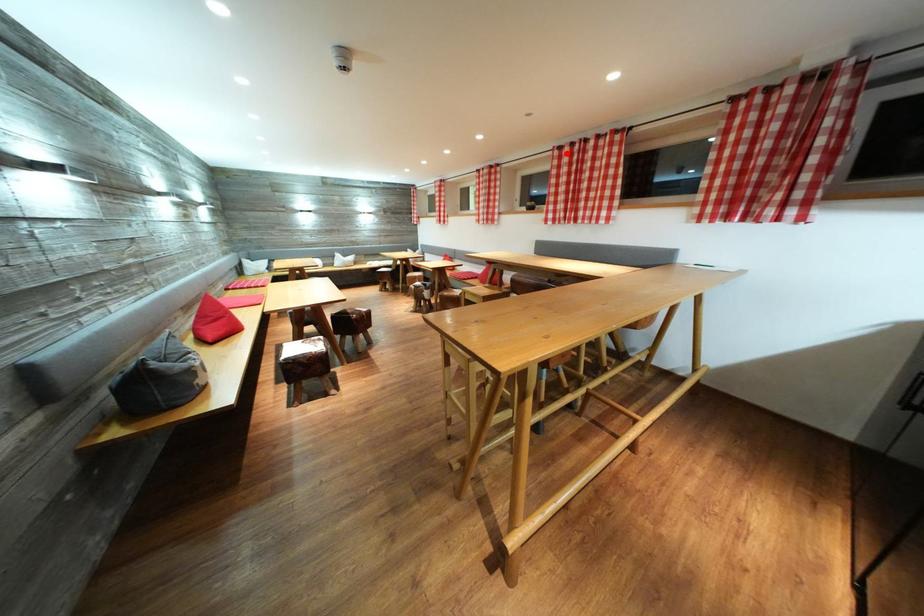
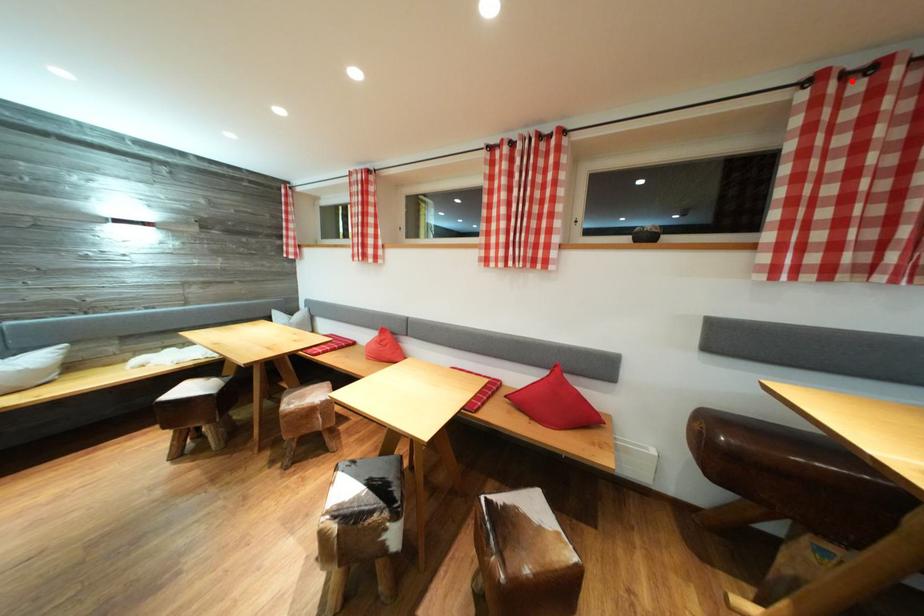
I am providing you with two images of the same scene from different viewpoints. A red point is marked on the first image and another point is marked on the second image. Is the red point in image1 aligned with the point shown in image2?

Yes